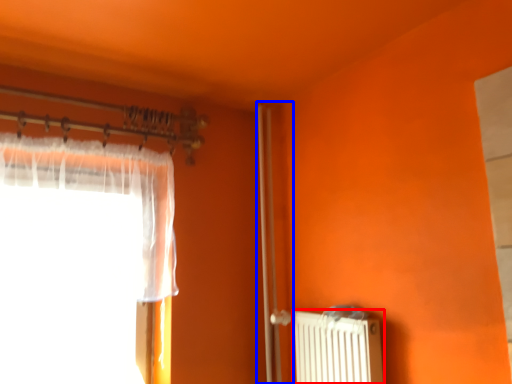
Question: Which of the following is the closest to the observer, radiator (highlighted by a red box) or screen door (highlighted by a blue box)?

Choices:
 (A) radiator
 (B) screen door

Answer: (A)